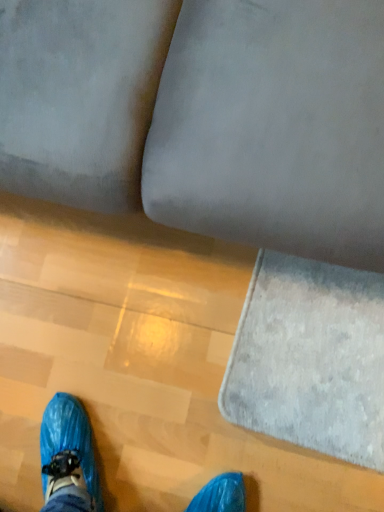
Question: Can you confirm if white fluffy mat at lower right is thinner than velvet gray couch at center?

Choices:
 (A) yes
 (B) no

Answer: (A)

Question: Considering the relative sizes of white fluffy mat at lower right and velvet gray couch at center in the image provided, is white fluffy mat at lower right shorter than velvet gray couch at center?

Choices:
 (A) no
 (B) yes

Answer: (B)

Question: Is white fluffy mat at lower right positioned in front of velvet gray couch at center?

Choices:
 (A) no
 (B) yes

Answer: (A)

Question: Considering the relative sizes of white fluffy mat at lower right and velvet gray couch at center in the image provided, is white fluffy mat at lower right bigger than velvet gray couch at center?

Choices:
 (A) yes
 (B) no

Answer: (B)

Question: Is white fluffy mat at lower right looking in the opposite direction of velvet gray couch at center?

Choices:
 (A) yes
 (B) no

Answer: (A)

Question: Is white fluffy mat at lower right aimed at velvet gray couch at center?

Choices:
 (A) yes
 (B) no

Answer: (B)

Question: Considering the relative sizes of velvet gray couch at center and white fluffy mat at lower right in the image provided, is velvet gray couch at center taller than white fluffy mat at lower right?

Choices:
 (A) no
 (B) yes

Answer: (B)

Question: Is velvet gray couch at center aimed at white fluffy mat at lower right?

Choices:
 (A) no
 (B) yes

Answer: (B)

Question: Does velvet gray couch at center come behind white fluffy mat at lower right?

Choices:
 (A) yes
 (B) no

Answer: (B)

Question: Is velvet gray couch at center positioned in front of white fluffy mat at lower right?

Choices:
 (A) no
 (B) yes

Answer: (B)

Question: From a real-world perspective, is velvet gray couch at center positioned under white fluffy mat at lower right based on gravity?

Choices:
 (A) no
 (B) yes

Answer: (A)

Question: Is velvet gray couch at center to the right of white fluffy mat at lower right from the viewer's perspective?

Choices:
 (A) yes
 (B) no

Answer: (B)

Question: From a real-world perspective, relative to white fluffy mat at lower right, is velvet gray couch at center vertically above or below?

Choices:
 (A) below
 (B) above

Answer: (B)